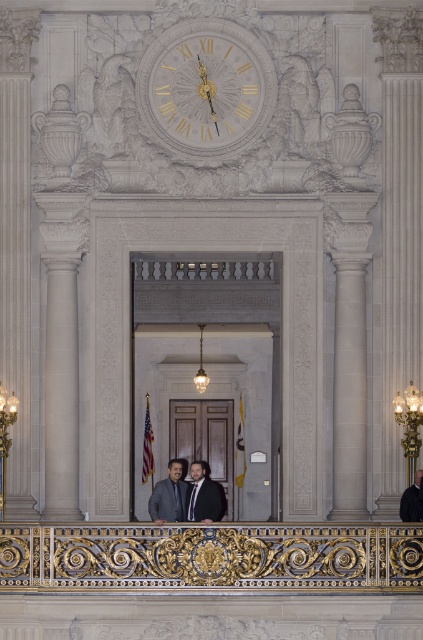
This screenshot has width=423, height=640. What do you see at coordinates (206, 88) in the screenshot? I see `gold metallic clock at upper center` at bounding box center [206, 88].

Find the location of `gold metallic clock at upper center`. gold metallic clock at upper center is located at coordinates (206, 88).

This screenshot has width=423, height=640. I want to click on gold metallic clock at upper center, so click(x=206, y=88).

Which of these two, dark gray matte business suit at center or dark gray suit at lower right, stands taller?

dark gray matte business suit at center

Can you confirm if dark gray matte business suit at center is taller than dark gray suit at lower right?

Correct, dark gray matte business suit at center is much taller as dark gray suit at lower right.

Between point (167, 480) and point (415, 490), which one is positioned in front?

Positioned in front is point (415, 490).

You are a GUI agent. You are given a task and a screenshot of the screen. Output one action in this format:
    pyautogui.click(x=<x>, y=<y>)
    Task: Click on the dark gray matte business suit at center
    
    Given the screenshot: What is the action you would take?
    pyautogui.click(x=167, y=500)

Based on the photo, can you confirm if matte black suit at center is positioned to the left of dark gray matte business suit at center?

No, matte black suit at center is not to the left of dark gray matte business suit at center.

Between point (181, 509) and point (148, 506), which one is positioned in front?

Point (181, 509) is more forward.

Find the location of `matte black suit at center`. matte black suit at center is located at coordinates click(x=187, y=496).